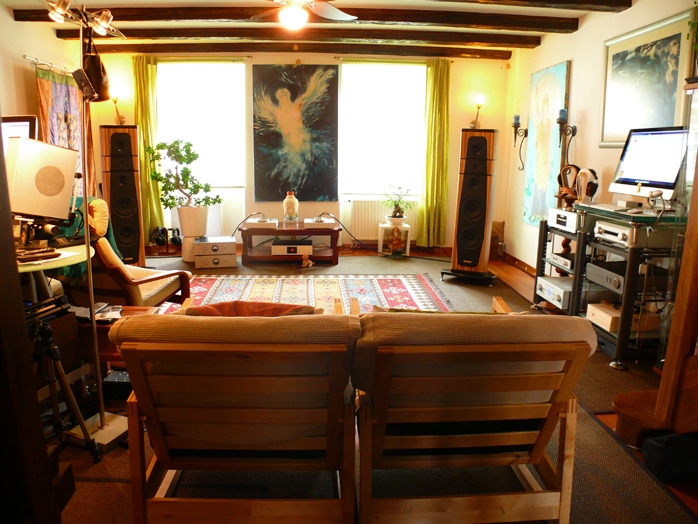
The width and height of the screenshot is (698, 524). Identify the location of painting in frame. (666, 61).